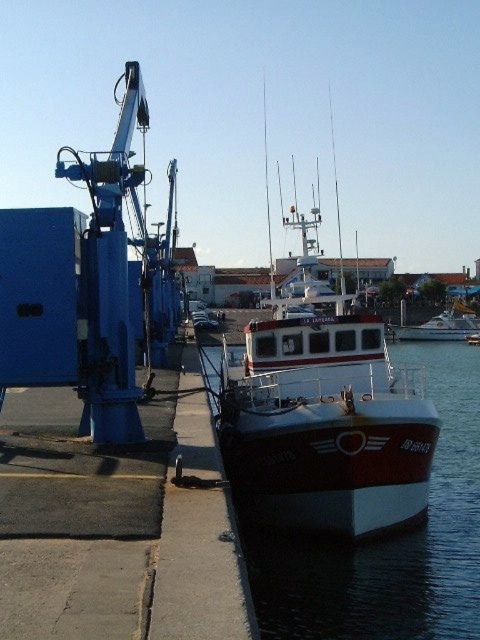
Question: Is white glossy water at center further to camera compared to white glossy boat at center?

Choices:
 (A) yes
 (B) no

Answer: (B)

Question: Considering the relative positions of white glossy water at center and white glossy boat at center in the image provided, where is white glossy water at center located with respect to white glossy boat at center?

Choices:
 (A) above
 (B) below

Answer: (B)

Question: Does white glossy water at center appear on the left side of white glossy boat at center?

Choices:
 (A) no
 (B) yes

Answer: (B)

Question: Which of the following is the closest to the observer?

Choices:
 (A) (262, 627)
 (B) (430, 321)

Answer: (A)